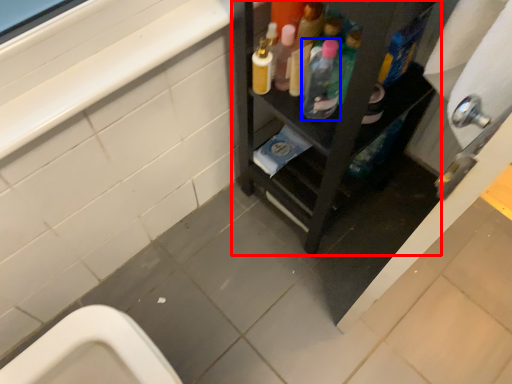
Question: Which of the following is the closest to the observer, furniture (highlighted by a red box) or bottle (highlighted by a blue box)?

Choices:
 (A) furniture
 (B) bottle

Answer: (A)